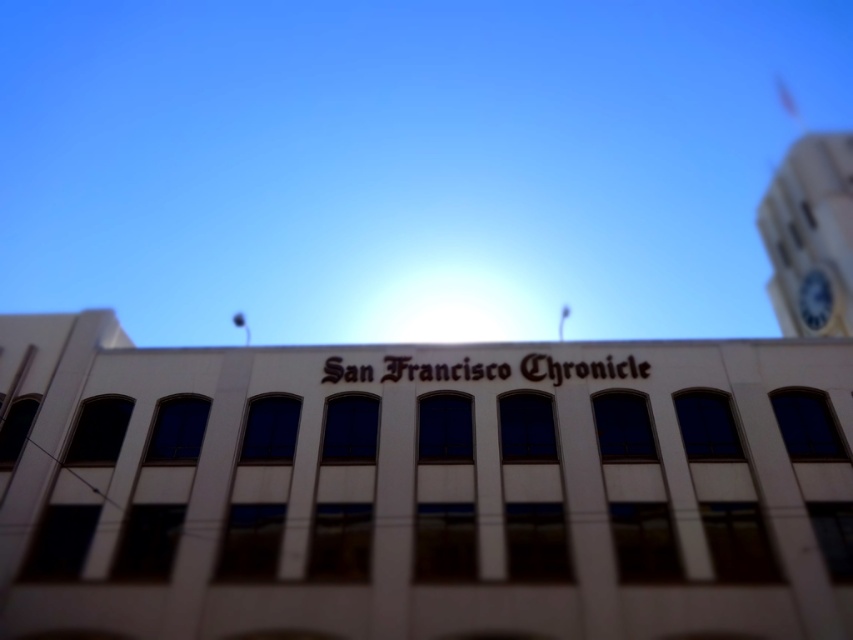
This screenshot has width=853, height=640. What do you see at coordinates (810, 236) in the screenshot?
I see `white clock tower at upper right` at bounding box center [810, 236].

Consider the image. Does white clock tower at upper right lie behind blue metallic clock at upper right?

No, white clock tower at upper right is closer to the viewer.

Image resolution: width=853 pixels, height=640 pixels. I want to click on white clock tower at upper right, so click(x=810, y=236).

The height and width of the screenshot is (640, 853). Identify the location of white clock tower at upper right. (810, 236).